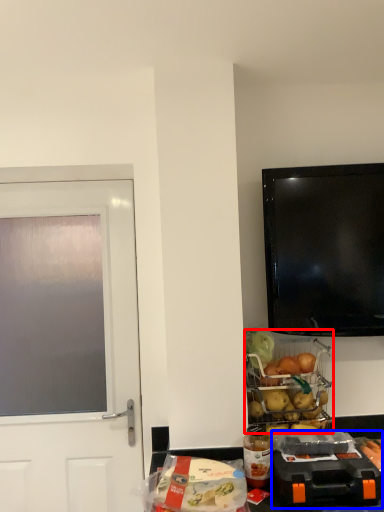
Question: Which point is closer to the camera, appliance (highlighted by a red box) or appliance (highlighted by a blue box)?

Choices:
 (A) appliance
 (B) appliance

Answer: (B)